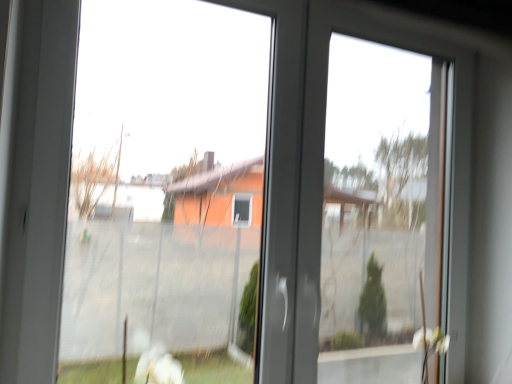
In order to face transparent glass window screen at center, should I rotate leftwards or rightwards?

It's best to rotate left around 9.929 degrees.

Describe the element at coordinates (165, 192) in the screenshot. I see `transparent glass window screen at center` at that location.

The width and height of the screenshot is (512, 384). I want to click on transparent glass window screen at center, so click(165, 192).

This screenshot has height=384, width=512. Find the location of `transparent glass window screen at center`. transparent glass window screen at center is located at coordinates (165, 192).